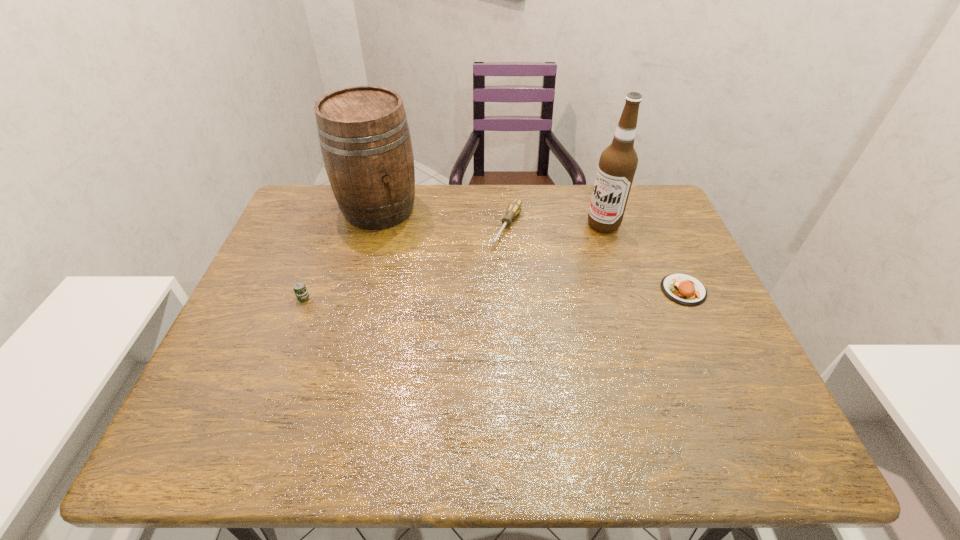
The width and height of the screenshot is (960, 540). What are the coordinates of `unoccupied area between the patty (food) and the second object from right to left` in the screenshot? It's located at (643, 258).

What are the coordinates of `vacant area between the screwdriver and the patty (food)` in the screenshot? It's located at (595, 259).

Where is `free space between the third shortest object and the second tallest object`? free space between the third shortest object and the second tallest object is located at coordinates (342, 253).

Locate an element on the screen. vacant area that lies between the second object from right to left and the third shortest object is located at coordinates (453, 261).

The height and width of the screenshot is (540, 960). I want to click on free spot between the patty (food) and the screwdriver, so click(x=595, y=259).

Identify the location of empty space between the second tallest object and the third object from left to right. (444, 218).

Find the location of a particular element. Image resolution: width=960 pixels, height=540 pixels. free point between the patty (food) and the screwdriver is located at coordinates (595, 259).

Locate an element on the screen. The image size is (960, 540). unoccupied area between the third shortest object and the alcohol is located at coordinates (453, 261).

The height and width of the screenshot is (540, 960). I want to click on object that is the second closest to the beer can, so click(514, 208).

Image resolution: width=960 pixels, height=540 pixels. What are the coordinates of `object that is the fourth nearest to the screwdriver` in the screenshot? It's located at (301, 292).